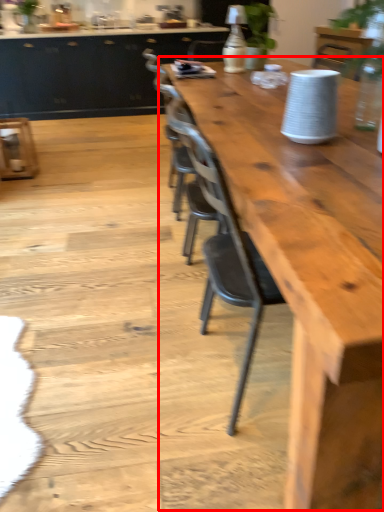
Question: Observing the image, what is the correct spatial positioning of table (annotated by the red box) in reference to cabinetry?

Choices:
 (A) right
 (B) left

Answer: (A)